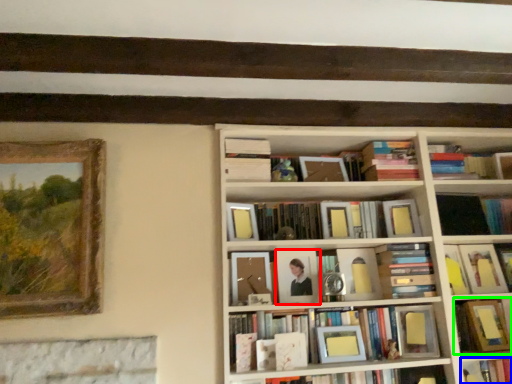
Question: Which object is positioned closest to picture frame (highlighted by a red box)? Select from book (highlighted by a blue box) and book (highlighted by a green box).

Choices:
 (A) book
 (B) book

Answer: (B)